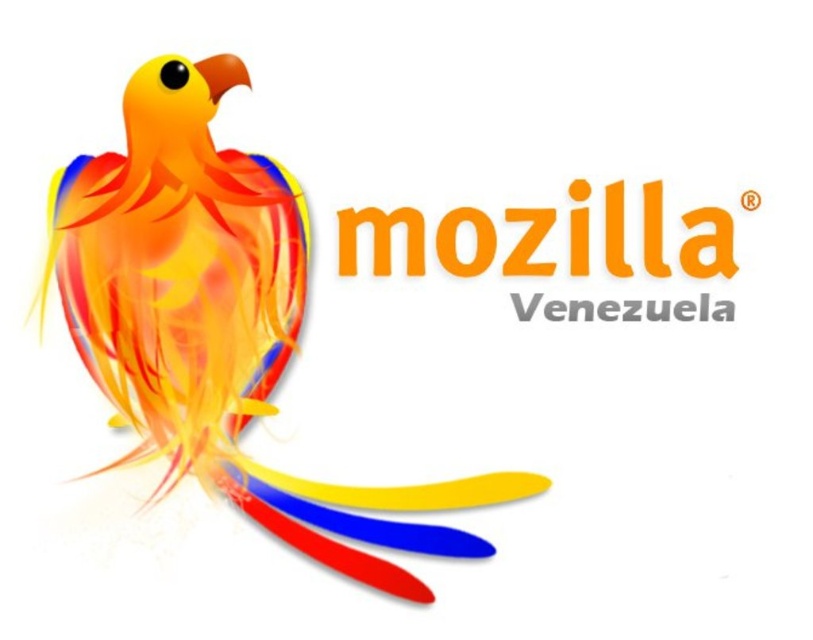
You are an animator working on a project and need to determine the order of layers for the Mozilla Venezuela logo. The logo has two points labeled as point (x=229, y=429) and point (x=694, y=241). Which point should be placed on a lower layer to ensure proper visibility of both elements?

Point (x=229, y=429) should be placed on a lower layer because it is behind point (x=694, y=241), ensuring that both elements remain visible.